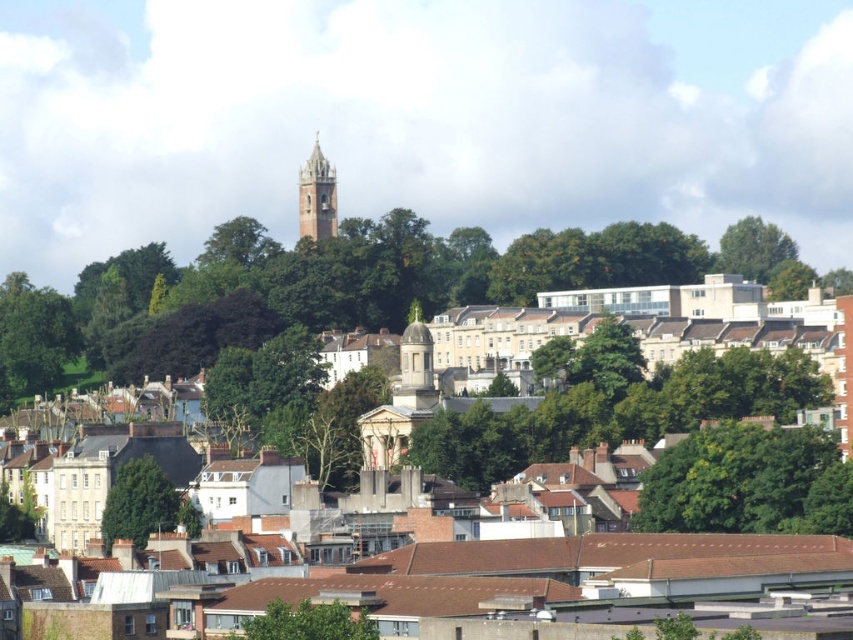
You are an urban planner assessing the cityscape. You need to determine which object, the green leafy tree at lower center or the white stone dome at center, is shorter. Based on the scene, which one is shorter?

The green leafy tree at lower center is shorter than the white stone dome at center.

You are standing at the point marked by the coordinate point at point (306, 621). Looking around, you see a dense cluster of buildings with light facades and red roofs in the foreground, a classical dome building with columns in the midground surrounded by green trees, and a tall clock tower in the background. Which direction should you walk to reach the tall clock tower in the background?

The point (306, 621) is on the green leafy tree at lower center. To reach the tall clock tower in the background, you should walk forward as the clock tower is located behind the current position marked by the point.

You are a city planner reviewing this area and need to determine if the green leafy tree at lower center is located directly beneath the white stone dome at center. Based on the provided image, can you confirm this relationship?

Yes, the green leafy tree at lower center is positioned under the white stone dome at center, confirming its location directly beneath it.